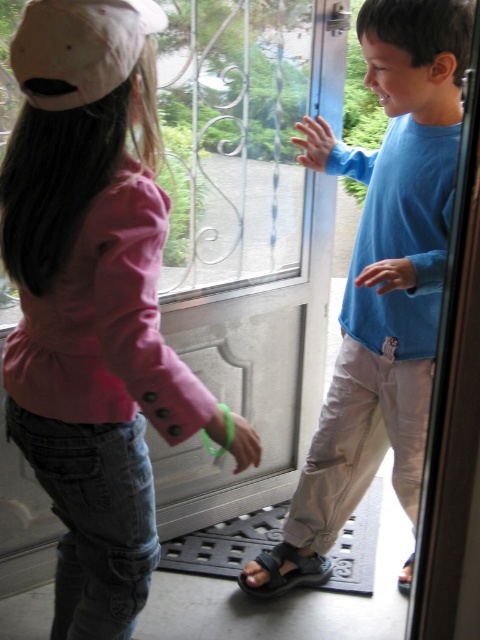
Is blue cotton shirt at center thinner than black rubber sandal at lower center?

No, blue cotton shirt at center is not thinner than black rubber sandal at lower center.

Is blue cotton shirt at center to the left of black rubber sandal at lower center from the viewer's perspective?

Yes, blue cotton shirt at center is to the left of black rubber sandal at lower center.

What do you see at coordinates (387, 262) in the screenshot?
I see `blue cotton shirt at center` at bounding box center [387, 262].

Image resolution: width=480 pixels, height=640 pixels. What are the coordinates of `blue cotton shirt at center` in the screenshot? It's located at click(387, 262).

Between black leather sandal at lower center and black rubber sandal at lower center, which one is positioned higher?

black leather sandal at lower center

Can you confirm if black leather sandal at lower center is bigger than black rubber sandal at lower center?

Yes.

Which is in front, point (278, 548) or point (409, 561)?

Point (278, 548)

Locate an element on the screen. Image resolution: width=480 pixels, height=640 pixels. black leather sandal at lower center is located at coordinates (284, 572).

Who is positioned more to the left, pink fabric jacket at left or black leather sandal at lower center?

→ pink fabric jacket at left is more to the left.

The width and height of the screenshot is (480, 640). Identify the location of pink fabric jacket at left. (95, 301).

Is point (197, 400) closer to viewer compared to point (302, 556)?

That is True.

Where is `pink fabric jacket at left`? pink fabric jacket at left is located at coordinates (95, 301).